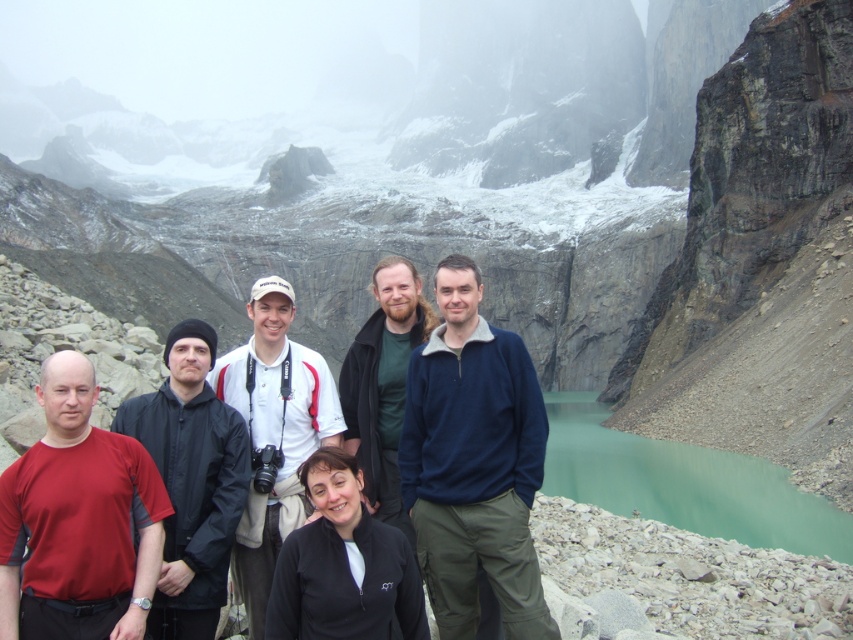
Who is positioned more to the right, matte red t-shirt at left or matte green sweater at center?

matte green sweater at center is more to the right.

Between point (30, 509) and point (399, 300), which one is positioned behind?

The point (399, 300) is more distant.

At what (x,y) coordinates should I click in order to perform the action: click on matte red t-shirt at left. Please return your answer as a coordinate pair (x, y). The width and height of the screenshot is (853, 640). Looking at the image, I should click on (78, 520).

From the picture: Can you confirm if matte red t-shirt at left is thinner than teal glassy water at lower right?

Correct, matte red t-shirt at left's width is less than teal glassy water at lower right's.

Consider the image. Who is higher up, matte red t-shirt at left or teal glassy water at lower right?

Positioned higher is matte red t-shirt at left.

Who is more forward, (134, 618) or (815, 502)?

Positioned in front is point (134, 618).

You are a GUI agent. You are given a task and a screenshot of the screen. Output one action in this format:
    pyautogui.click(x=<x>, y=<y>)
    Task: Click on the matte red t-shirt at left
    The width and height of the screenshot is (853, 640).
    Given the screenshot: What is the action you would take?
    pyautogui.click(x=78, y=520)

Which of these two, matte red t-shirt at left or black matte jacket at left, stands shorter?

Standing shorter between the two is matte red t-shirt at left.

Does matte red t-shirt at left have a greater width compared to black matte jacket at left?

Correct, the width of matte red t-shirt at left exceeds that of black matte jacket at left.

Does point (70, 577) lie in front of point (190, 611)?

Yes, point (70, 577) is in front of point (190, 611).

At what (x,y) coordinates should I click in order to perform the action: click on matte red t-shirt at left. Please return your answer as a coordinate pair (x, y). Looking at the image, I should click on (78, 520).